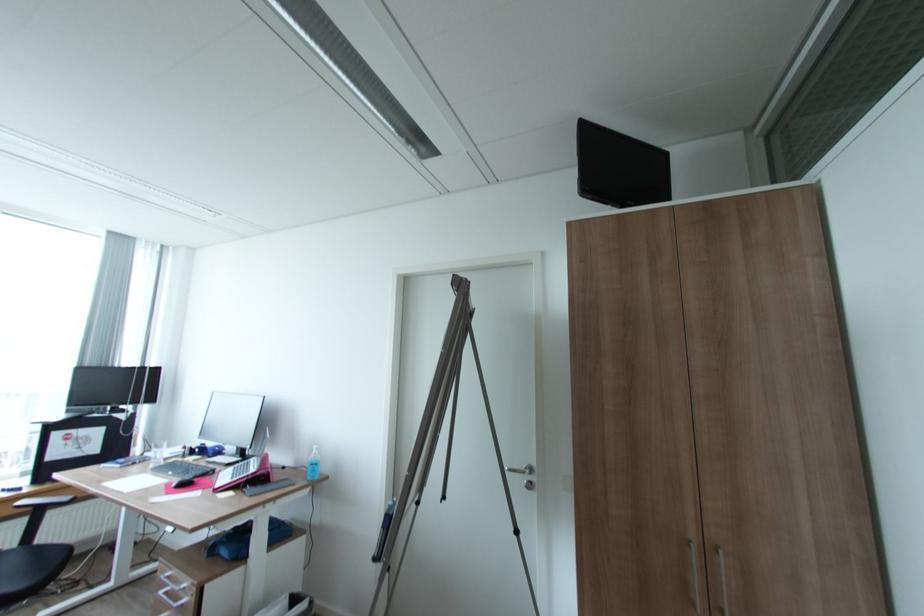
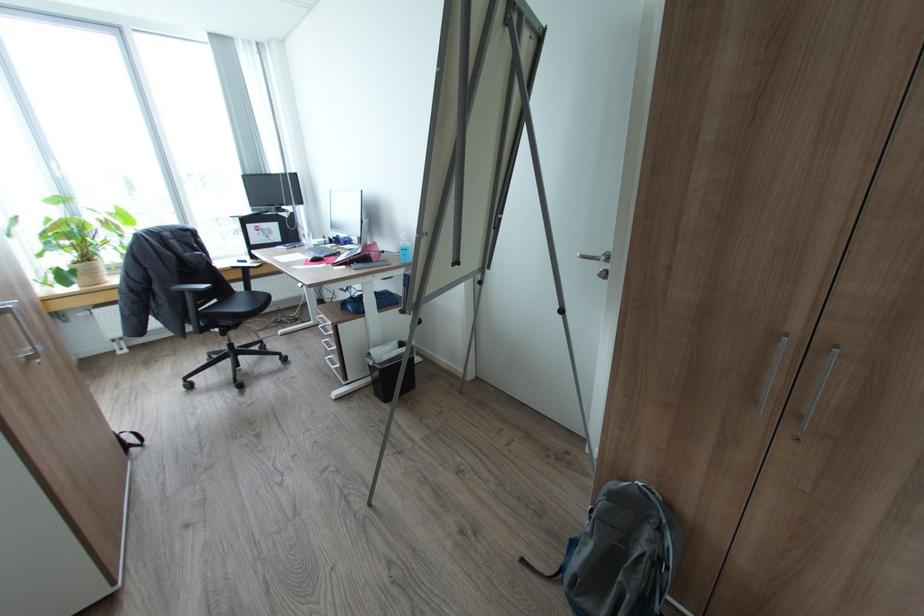
Locate, in the second image, the point that corresponds to the point at 511,468 in the first image.

(582, 254)